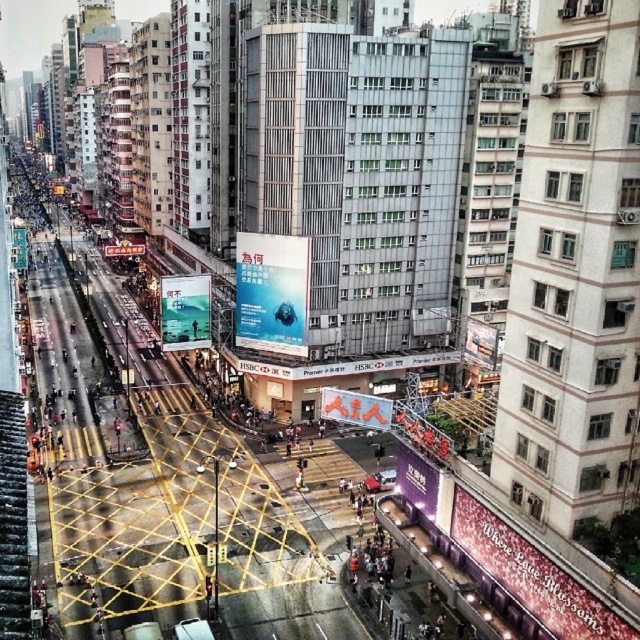
You are a pedestrian standing at the intersection and looking towards the center of the image. Which object, the matte blue poster at center or the matte red sign at center, appears closer to you?

The matte blue poster at center appears closer because the matte red sign at center is positioned behind it.

You are standing at the intersection and want to reach the point marked as point (182, 288). Which direction should you move relative to point (355, 412)?

You should move behind point (355, 412) to reach point (182, 288) because point (182, 288) is located behind point (355, 412).

You are a city planner analyzing the visibility of advertisements in this area. Given the presence of the matte pink billboard at lower right and the matte red sign at center, which one is more likely to be seen by pedestrians crossing the intersection?

The matte pink billboard at lower right is more likely to be seen by pedestrians crossing the intersection because it is positioned at the lower right, which is closer to the pedestrian crossing area compared to the matte red sign at center.